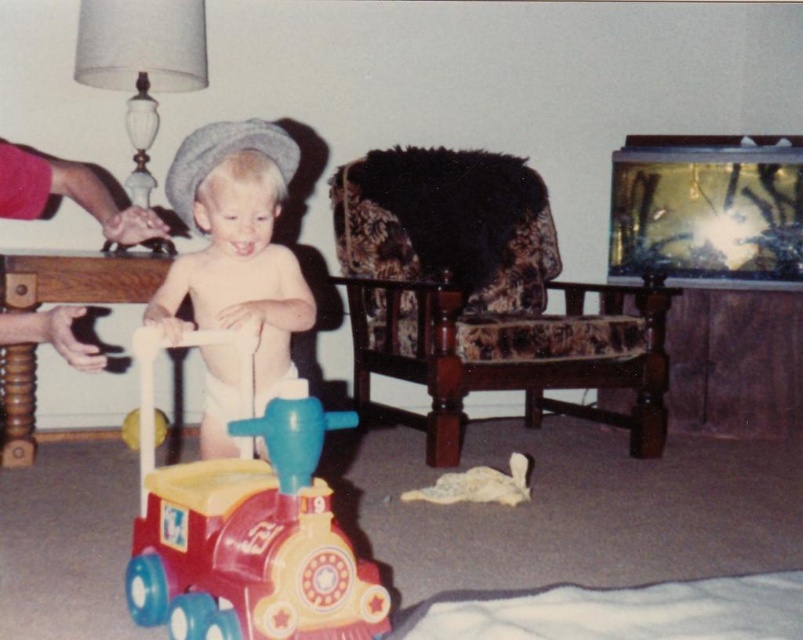
You are a parent trying to ensure your child stays within the play area. The plastic train at center and smooth beige baby walker at center are both in the child play area. Which object is closer to the right edge of the play area?

The plastic train at center is closer to the right edge of the play area because it is positioned to the right of the smooth beige baby walker at center.

You are a parent who wants to ensure your child can safely play with both the plastic train at center and the smooth beige baby walker at center. Based on their positions, which object is closer to the child?

The plastic train at center is closer to the child because it is positioned in front of the smooth beige baby walker at center, meaning it is nearer to the child.